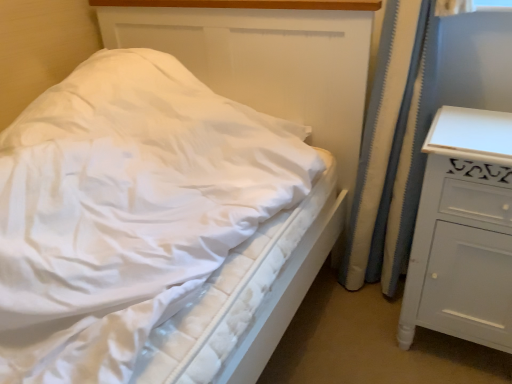
This screenshot has width=512, height=384. What do you see at coordinates (383, 138) in the screenshot?
I see `white textured curtain at right` at bounding box center [383, 138].

Identify the location of white quilted mattress at center. (143, 222).

Between white textured curtain at right and white quilted mattress at center, which one appears on the left side from the viewer's perspective?

white quilted mattress at center is more to the left.

Would you consider white textured curtain at right to be distant from white quilted mattress at center?

They are positioned close to each other.

Which object is closer to the camera, white textured curtain at right or white quilted mattress at center?

white quilted mattress at center is more forward.

Is white quilted mattress at center closer to camera compared to white painted wood chest of drawers at right?

Yes, white quilted mattress at center is in front of white painted wood chest of drawers at right.

From a real-world perspective, is white quilted mattress at center located beneath white painted wood chest of drawers at right?

Incorrect, from a real-world perspective, white quilted mattress at center is higher than white painted wood chest of drawers at right.

Are white quilted mattress at center and white painted wood chest of drawers at right located far from each other?

No, white quilted mattress at center is not far away from white painted wood chest of drawers at right.

Is white quilted mattress at center shorter than white painted wood chest of drawers at right?

No.

Based on the photo, could you tell me if white painted wood chest of drawers at right is turned towards white textured curtain at right?

No, white painted wood chest of drawers at right does not turn towards white textured curtain at right.

Can you confirm if white painted wood chest of drawers at right is shorter than white textured curtain at right?

Yes.

The width and height of the screenshot is (512, 384). In order to click on chest of drawers in front of the white textured curtain at right in this screenshot , I will do `click(463, 232)`.

Is white painted wood chest of drawers at right inside or outside of white textured curtain at right?

white painted wood chest of drawers at right is outside white textured curtain at right.

Measure the distance between white painted wood chest of drawers at right and white quilted mattress at center.

white painted wood chest of drawers at right is 22.30 inches from white quilted mattress at center.

Locate an element on the screen. bed lying on the left of white painted wood chest of drawers at right is located at coordinates (143, 222).

Is white painted wood chest of drawers at right directly adjacent to white quilted mattress at center?

No, white painted wood chest of drawers at right is not in contact with white quilted mattress at center.

From a real-world perspective, which object rests below the other?

white painted wood chest of drawers at right, from a real-world perspective.

Is white textured curtain at right a part of white quilted mattress at center?

No, white textured curtain at right is located outside of white quilted mattress at center.

Does white quilted mattress at center turn towards white textured curtain at right?

No, white quilted mattress at center is not oriented towards white textured curtain at right.

Between point (258, 142) and point (368, 202), which one is positioned behind?

The point (368, 202) is farther.

I want to click on bed located on the left of white textured curtain at right, so click(143, 222).

Is white textured curtain at right not within white painted wood chest of drawers at right?

Yes, white textured curtain at right is located beyond the bounds of white painted wood chest of drawers at right.

From the image's perspective, is white textured curtain at right located above or below white painted wood chest of drawers at right?

From the image's perspective, white textured curtain at right appears above white painted wood chest of drawers at right.

Is point (417, 51) behind point (493, 254)?

Yes, point (417, 51) is farther from viewer.

Where is `bed on the left of white textured curtain at right`? The height and width of the screenshot is (384, 512). bed on the left of white textured curtain at right is located at coordinates (143, 222).

At what (x,y) coordinates should I click in order to perform the action: click on bed in front of the white painted wood chest of drawers at right. Please return your answer as a coordinate pair (x, y). Image resolution: width=512 pixels, height=384 pixels. Looking at the image, I should click on (143, 222).

Based on their spatial positions, is white textured curtain at right or white quilted mattress at center further from white painted wood chest of drawers at right?

→ white quilted mattress at center lies further to white painted wood chest of drawers at right than the other object.

Which object lies further to the anchor point white textured curtain at right, white painted wood chest of drawers at right or white quilted mattress at center?

Based on the image, white quilted mattress at center appears to be further to white textured curtain at right.

Considering their positions, is white quilted mattress at center positioned further to white textured curtain at right than white painted wood chest of drawers at right?

white quilted mattress at center lies further to white textured curtain at right than the other object.

Considering their positions, is white painted wood chest of drawers at right positioned closer to white quilted mattress at center than white textured curtain at right?

Based on the image, white painted wood chest of drawers at right appears to be nearer to white quilted mattress at center.

Considering their positions, is white textured curtain at right positioned further to white quilted mattress at center than white painted wood chest of drawers at right?

Based on the image, white textured curtain at right appears to be further to white quilted mattress at center.

From the image, which object appears to be nearer to white painted wood chest of drawers at right, white quilted mattress at center or white textured curtain at right?

white textured curtain at right.

You are a GUI agent. You are given a task and a screenshot of the screen. Output one action in this format:
    pyautogui.click(x=<x>, y=<y>)
    Task: Click on the curtain between white quilted mattress at center and white painted wood chest of drawers at right in the horizontal direction
    The height and width of the screenshot is (384, 512).
    Given the screenshot: What is the action you would take?
    pyautogui.click(x=383, y=138)